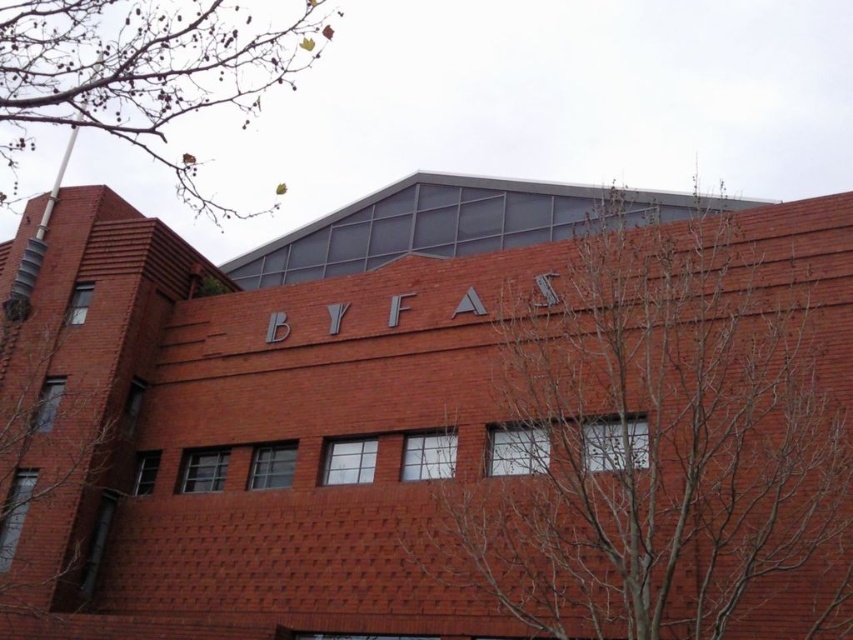
Between bare branches at center and brown leafy tree at upper left, which one appears on the right side from the viewer's perspective?

From the viewer's perspective, bare branches at center appears more on the right side.

Does bare branches at center have a lesser height compared to brown leafy tree at upper left?

Correct, bare branches at center is not as tall as brown leafy tree at upper left.

Which is in front, point (561, 368) or point (107, 122)?

Point (561, 368) is more forward.

Identify the location of bare branches at center. The width and height of the screenshot is (853, 640). (653, 436).

Between bare branches at center and bare branches at left, which one is positioned higher?

bare branches at center is above.

Is bare branches at center positioned at the back of bare branches at left?

No.

What are the coordinates of `bare branches at center` in the screenshot? It's located at (653, 436).

In order to click on bare branches at center in this screenshot , I will do `click(653, 436)`.

Which is behind, point (27, 4) or point (62, 340)?

The point (62, 340) is more distant.

Is point (177, 166) behind point (59, 541)?

Yes, it is behind point (59, 541).

Does point (181, 177) come closer to viewer compared to point (9, 348)?

No, it is behind (9, 348).

Locate an element on the screen. The image size is (853, 640). brown leafy tree at upper left is located at coordinates (144, 72).